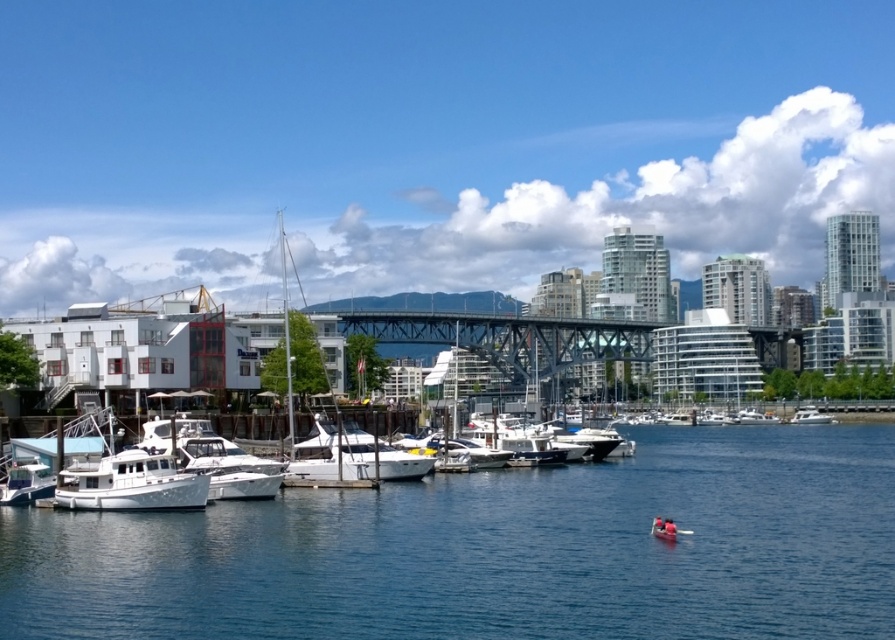
The height and width of the screenshot is (640, 895). Describe the element at coordinates (26, 483) in the screenshot. I see `white matte boat at left` at that location.

Can you confirm if white matte boat at left is thinner than white matte boat at center?

Yes.

What do you see at coordinates (26, 483) in the screenshot? I see `white matte boat at left` at bounding box center [26, 483].

Find the location of `white matte boat at left`. white matte boat at left is located at coordinates (26, 483).

Does clear blue water at center have a lesser height compared to white glossy boat at center?

Yes.

Is point (501, 529) farther from viewer compared to point (376, 458)?

No, (501, 529) is in front of (376, 458).

What do you see at coordinates (496, 552) in the screenshot? I see `clear blue water at center` at bounding box center [496, 552].

You are a GUI agent. You are given a task and a screenshot of the screen. Output one action in this format:
    pyautogui.click(x=<x>, y=<y>)
    Task: Click on the clear blue water at center
    This screenshot has height=640, width=895.
    Given the screenshot: What is the action you would take?
    pyautogui.click(x=496, y=552)

Between point (359, 433) and point (797, 408), which one is positioned in front?

Point (359, 433)

Measure the distance between point [395,480] and camera.

The distance of point [395,480] from camera is 67.66 meters.

What do you see at coordinates (352, 456) in the screenshot? The height and width of the screenshot is (640, 895). I see `white glossy boat at center` at bounding box center [352, 456].

Find the location of a particular element. white glossy boat at center is located at coordinates (352, 456).